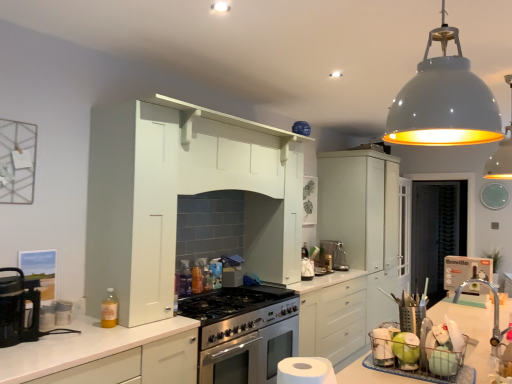
Question: Does satin silver coffee machine at center appear on the left side of white matte cabinet at lower left, which is counted as the first cabinetry, starting from the front?

Choices:
 (A) yes
 (B) no

Answer: (B)

Question: Is satin silver coffee machine at center facing away from white matte cabinet at lower left, which is counted as the first cabinetry, starting from the front?

Choices:
 (A) no
 (B) yes

Answer: (A)

Question: Can you confirm if satin silver coffee machine at center is smaller than white matte cabinet at lower left, which is counted as the first cabinetry, starting from the front?

Choices:
 (A) no
 (B) yes

Answer: (B)

Question: Is satin silver coffee machine at center outside of white matte cabinet at lower left, which is the 2th cabinetry from back to front?

Choices:
 (A) yes
 (B) no

Answer: (A)

Question: Is satin silver coffee machine at center surrounding white matte cabinet at lower left, which is the 2th cabinetry from back to front?

Choices:
 (A) yes
 (B) no

Answer: (B)

Question: From the image's perspective, is white matte dome at upper center, which ranks as the 2th light fixture in left-to-right order, above or below white glossy pendant lamp at upper right, the 1th light fixture viewed from the left?

Choices:
 (A) above
 (B) below

Answer: (B)

Question: Looking at the image, does white matte dome at upper center, which ranks as the 2th light fixture in left-to-right order, seem bigger or smaller compared to white glossy pendant lamp at upper right, which is counted as the second light fixture, starting from the right?

Choices:
 (A) small
 (B) big

Answer: (A)

Question: Which is correct: white matte dome at upper center, arranged as the 1th light fixture when viewed from the right, is inside white glossy pendant lamp at upper right, which is counted as the second light fixture, starting from the right, or outside of it?

Choices:
 (A) outside
 (B) inside

Answer: (A)

Question: From a real-world perspective, is white matte dome at upper center, arranged as the 1th light fixture when viewed from the right, above or below white glossy pendant lamp at upper right, marked as the 2th light fixture in a back-to-front arrangement?

Choices:
 (A) below
 (B) above

Answer: (B)

Question: Is translucent yellow bottle at lower left to the left or to the right of white glossy pendant lamp at upper right, the 1th light fixture viewed from the left, in the image?

Choices:
 (A) left
 (B) right

Answer: (A)

Question: From the image's perspective, is translucent yellow bottle at lower left located above or below white glossy pendant lamp at upper right, which is counted as the second light fixture, starting from the right?

Choices:
 (A) below
 (B) above

Answer: (A)

Question: Does point (113, 296) appear closer or farther from the camera than point (410, 109)?

Choices:
 (A) closer
 (B) farther

Answer: (B)

Question: Considering the positions of translucent yellow bottle at lower left and white glossy pendant lamp at upper right, the 1th light fixture positioned from the front, in the image, is translucent yellow bottle at lower left taller or shorter than white glossy pendant lamp at upper right, the 1th light fixture positioned from the front,?

Choices:
 (A) tall
 (B) short

Answer: (B)

Question: Considering the positions of white glossy pendant lamp at upper right, marked as the 2th light fixture in a back-to-front arrangement, and white matte dome at upper center, which ranks as the 1th light fixture in back-to-front order, in the image, is white glossy pendant lamp at upper right, marked as the 2th light fixture in a back-to-front arrangement, taller or shorter than white matte dome at upper center, which ranks as the 1th light fixture in back-to-front order,?

Choices:
 (A) short
 (B) tall

Answer: (A)

Question: From the image's perspective, is white glossy pendant lamp at upper right, the 1th light fixture positioned from the front, located above or below white matte dome at upper center, acting as the 2th light fixture starting from the front?

Choices:
 (A) above
 (B) below

Answer: (A)